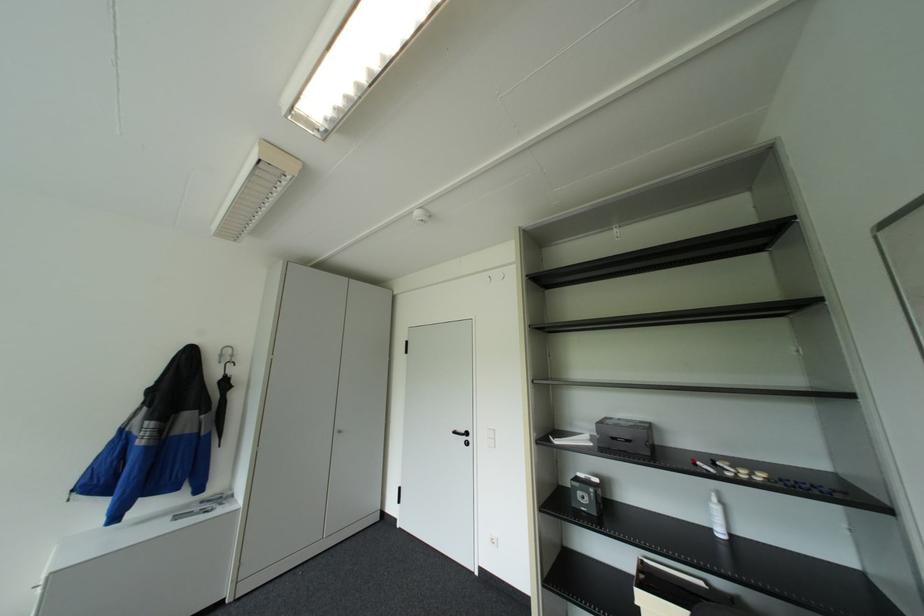
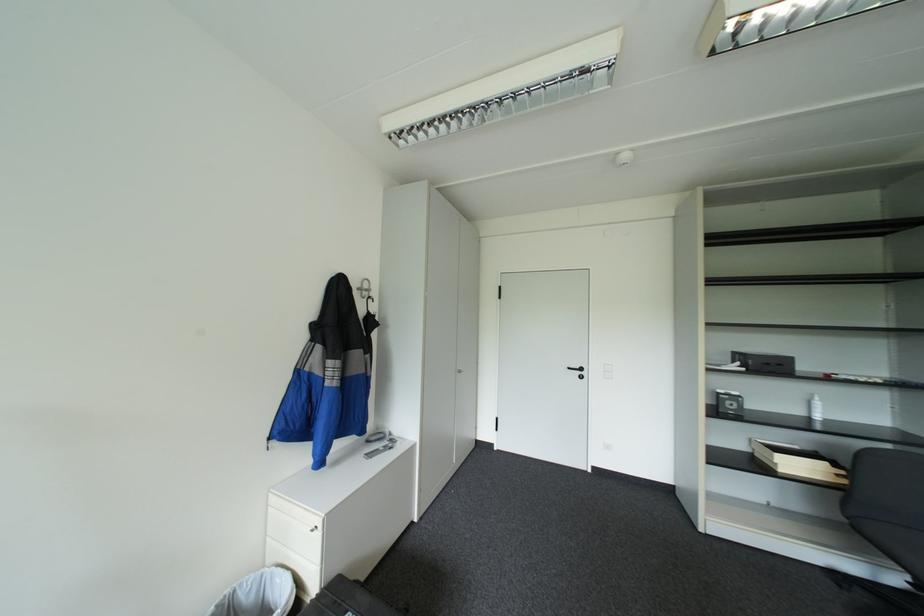
Question: What movement of the cameraman would produce the second image?

Choices:
 (A) Left
 (B) Right
 (C) Forward
 (D) Backward

Answer: (A)